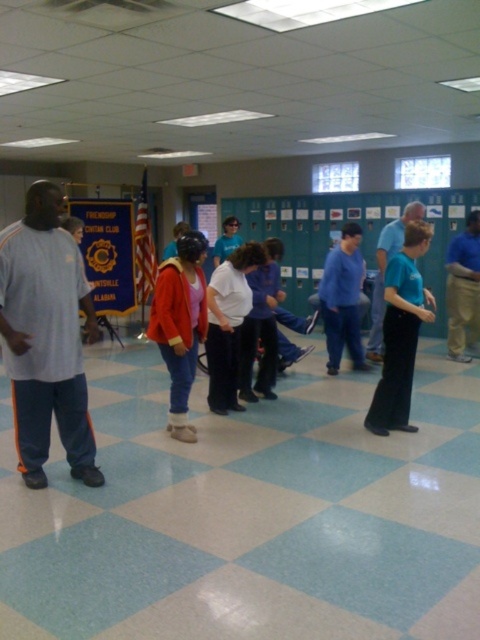
You are organizing a clothing donation drive and need to categorize items based on size. You have two items to sort out, the matte gray sweatshirt at left and the teal matte shirt at center. Which one should you place in the small size bin?

The matte gray sweatshirt at left has a smaller size compared to the teal matte shirt at center, so it should be placed in the small size bin.

You are standing at the entrance of the gymnasium and want to locate the matte gray sweatshirt at left. According to the coordinates provided, in which direction should you look relative to the entrance?

The matte gray sweatshirt at left is located at point (46, 337), which corresponds to the left side of the image. Therefore, you should look to your left relative to the entrance to find it.

From the picture: You are a photographer setting up for a group photo in the gym. You need to ensure that both the matte gray sweatshirt at left and the teal matte shirt at center are visible in the frame. Given their height difference, which one might you need to position closer to the camera to avoid being blocked?

The teal matte shirt at center is shorter than the matte gray sweatshirt at left. To prevent the shorter teal matte shirt at center from being blocked by the taller matte gray sweatshirt at left, position the teal matte shirt at center closer to the camera.